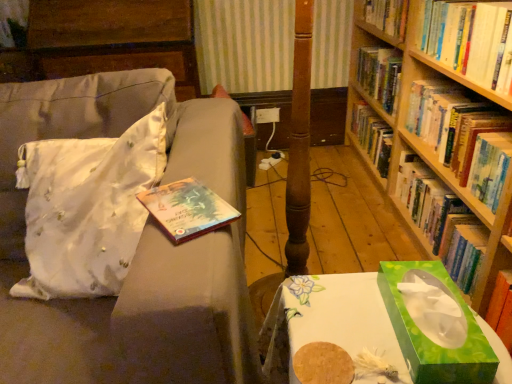
Locate an element on the screen. This screenshot has width=512, height=384. vacant space situated on the left part of green paper tissue box at lower right is located at coordinates (339, 328).